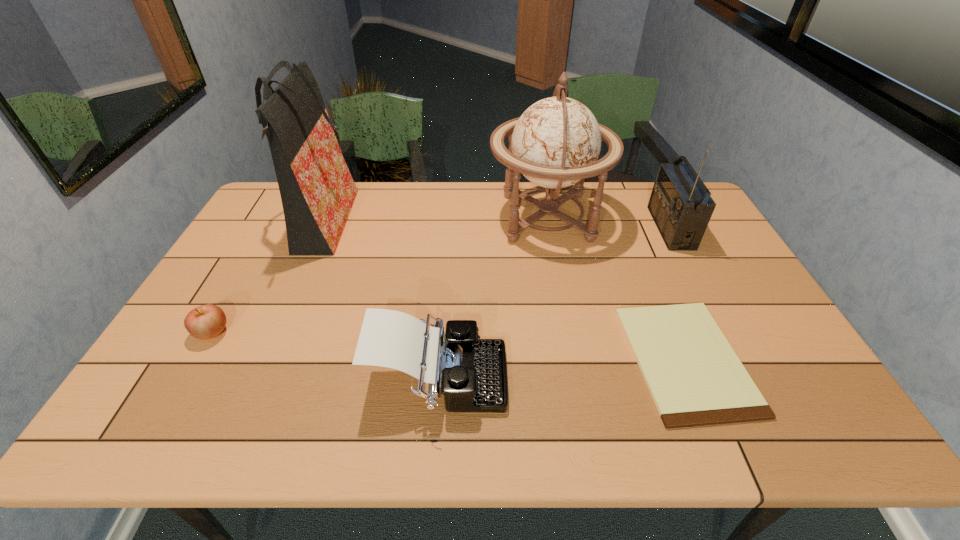
You are a GUI agent. You are given a task and a screenshot of the screen. Output one action in this format:
    pyautogui.click(x=<x>, y=<y>)
    Task: Click on the vacant area situated on the front-facing side of the globe
    Image resolution: width=960 pixels, height=540 pixels.
    Given the screenshot: What is the action you would take?
    pyautogui.click(x=374, y=217)

Where is `vacant space located 0.110m on the front panel of the fourth shortest object`? Image resolution: width=960 pixels, height=540 pixels. vacant space located 0.110m on the front panel of the fourth shortest object is located at coordinates (623, 228).

Image resolution: width=960 pixels, height=540 pixels. What are the coordinates of `vacant region located 0.290m on the front panel of the fourth shortest object` in the screenshot? It's located at (568, 228).

This screenshot has width=960, height=540. In order to click on free space located 0.110m on the front panel of the fourth shortest object in this screenshot , I will do `click(623, 228)`.

Identify the location of blank area located 0.350m on the keys of the typewriter. The image size is (960, 540). (656, 380).

Locate an element on the screen. The height and width of the screenshot is (540, 960). vacant space situated 0.100m on the front of the leftmost object is located at coordinates (185, 381).

You are a GUI agent. You are given a task and a screenshot of the screen. Output one action in this format:
    pyautogui.click(x=<x>, y=<y>)
    Task: Click on the free space located on the back of the clipboard
    This screenshot has height=540, width=960.
    Given the screenshot: What is the action you would take?
    pyautogui.click(x=652, y=278)

You are a GUI agent. You are given a task and a screenshot of the screen. Output one action in this format:
    pyautogui.click(x=<x>, y=<y>)
    Task: Click on the shopping bag located at the far edge
    
    Given the screenshot: What is the action you would take?
    pyautogui.click(x=317, y=191)

The image size is (960, 540). I want to click on globe situated at the far edge, so click(556, 142).

This screenshot has height=540, width=960. What are the coordinates of `radio receiver at the far edge` in the screenshot? It's located at (680, 204).